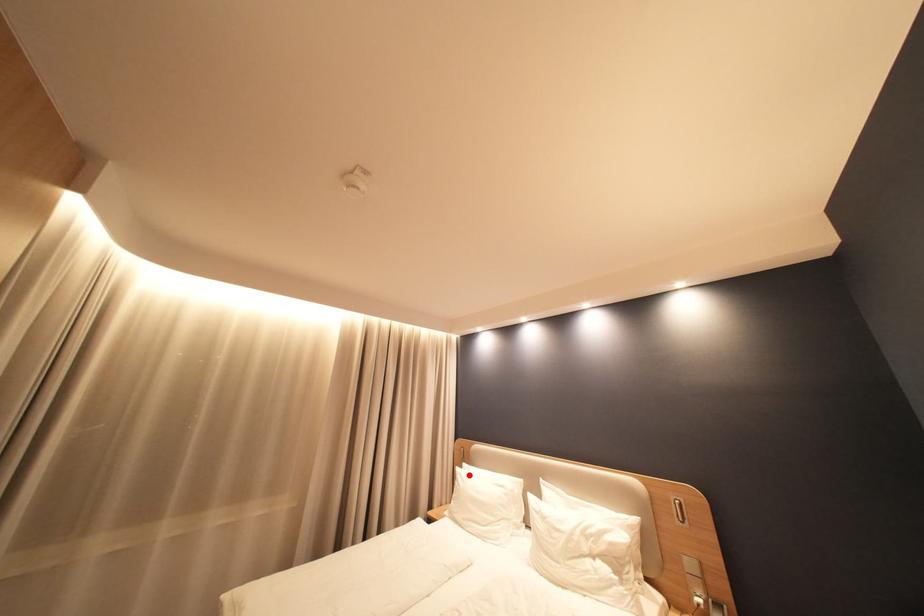
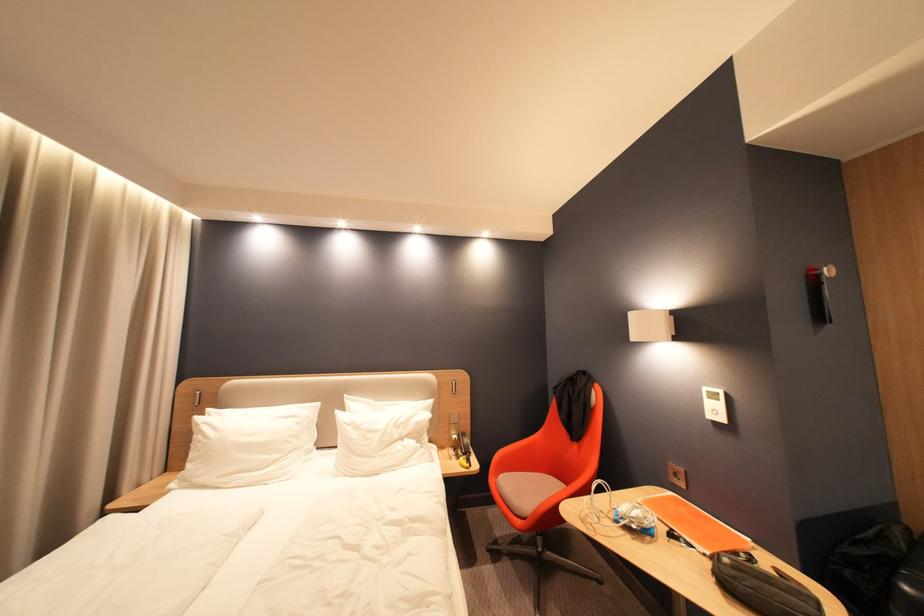
In the second image, find the point that corresponds to the highlighted location in the first image.

(213, 424)